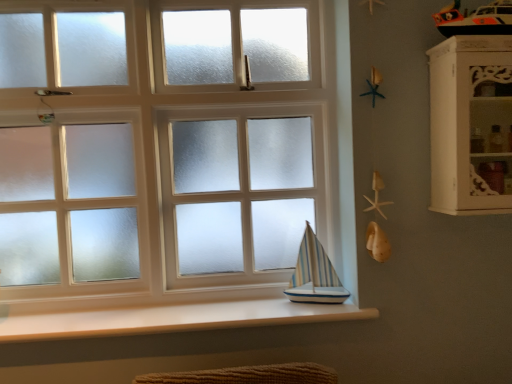
Question: From a real-world perspective, is blue striped wood sailboat at lower center over white wood cabinet at right?

Choices:
 (A) no
 (B) yes

Answer: (A)

Question: Does blue striped wood sailboat at lower center come behind white wood cabinet at right?

Choices:
 (A) no
 (B) yes

Answer: (B)

Question: Is blue striped wood sailboat at lower center not within white wood cabinet at right?

Choices:
 (A) no
 (B) yes

Answer: (B)

Question: From a real-world perspective, is blue striped wood sailboat at lower center below white wood cabinet at right?

Choices:
 (A) yes
 (B) no

Answer: (A)

Question: Can you confirm if blue striped wood sailboat at lower center is positioned to the left of white wood cabinet at right?

Choices:
 (A) no
 (B) yes

Answer: (B)

Question: Considering the positions of blue striped wood sailboat at lower center and white smooth wood at lower center in the image, is blue striped wood sailboat at lower center bigger or smaller than white smooth wood at lower center?

Choices:
 (A) small
 (B) big

Answer: (A)

Question: Considering the positions of blue striped wood sailboat at lower center and white smooth wood at lower center in the image, is blue striped wood sailboat at lower center taller or shorter than white smooth wood at lower center?

Choices:
 (A) short
 (B) tall

Answer: (B)

Question: Which is correct: blue striped wood sailboat at lower center is inside white smooth wood at lower center, or outside of it?

Choices:
 (A) outside
 (B) inside

Answer: (A)

Question: Is point (307, 256) closer or farther from the camera than point (321, 319)?

Choices:
 (A) farther
 (B) closer

Answer: (A)

Question: In terms of width, does white smooth wood at lower center look wider or thinner when compared to white wood cabinet at right?

Choices:
 (A) thin
 (B) wide

Answer: (B)

Question: In the image, is white smooth wood at lower center on the left side or the right side of white wood cabinet at right?

Choices:
 (A) left
 (B) right

Answer: (A)

Question: Which is correct: white smooth wood at lower center is inside white wood cabinet at right, or outside of it?

Choices:
 (A) outside
 (B) inside

Answer: (A)

Question: Considering their positions, is white smooth wood at lower center located in front of or behind white wood cabinet at right?

Choices:
 (A) behind
 (B) front

Answer: (A)

Question: Which is correct: white frosted glass at center is inside white smooth wood at lower center, or outside of it?

Choices:
 (A) inside
 (B) outside

Answer: (B)

Question: Considering the relative positions of white frosted glass at center and white smooth wood at lower center in the image provided, is white frosted glass at center to the left or to the right of white smooth wood at lower center?

Choices:
 (A) left
 (B) right

Answer: (A)